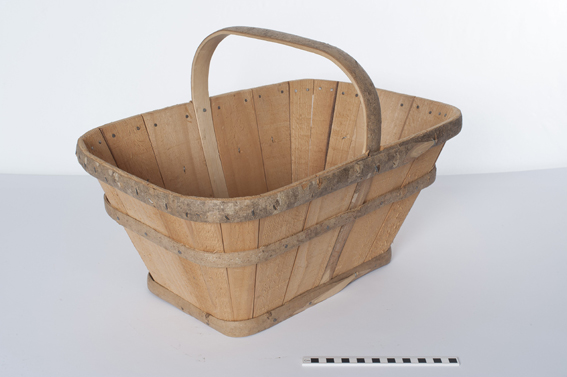
Locate an element on the screen. This screenshot has height=377, width=567. handle of bucket is located at coordinates (301, 44).